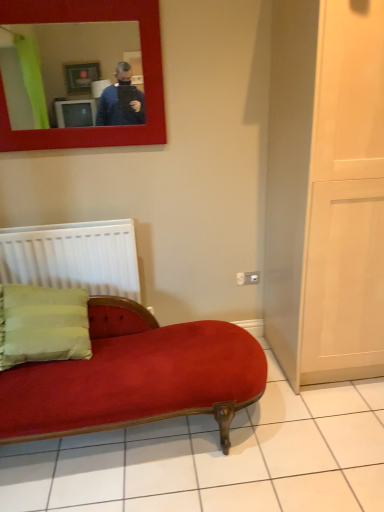
Question: From a real-world perspective, is white matte radiator at left above or below matte red mirror at upper left?

Choices:
 (A) below
 (B) above

Answer: (A)

Question: Is white matte radiator at left bigger or smaller than matte red mirror at upper left?

Choices:
 (A) small
 (B) big

Answer: (A)

Question: Would you say white matte radiator at left is inside or outside matte red mirror at upper left?

Choices:
 (A) outside
 (B) inside

Answer: (A)

Question: Based on their sizes in the image, would you say matte red mirror at upper left is bigger or smaller than white matte radiator at left?

Choices:
 (A) big
 (B) small

Answer: (A)

Question: From a real-world perspective, is matte red mirror at upper left positioned above or below white matte radiator at left?

Choices:
 (A) below
 (B) above

Answer: (B)

Question: From the image's perspective, is matte red mirror at upper left above or below white matte radiator at left?

Choices:
 (A) below
 (B) above

Answer: (B)

Question: In terms of width, does matte red mirror at upper left look wider or thinner when compared to white matte radiator at left?

Choices:
 (A) thin
 (B) wide

Answer: (A)